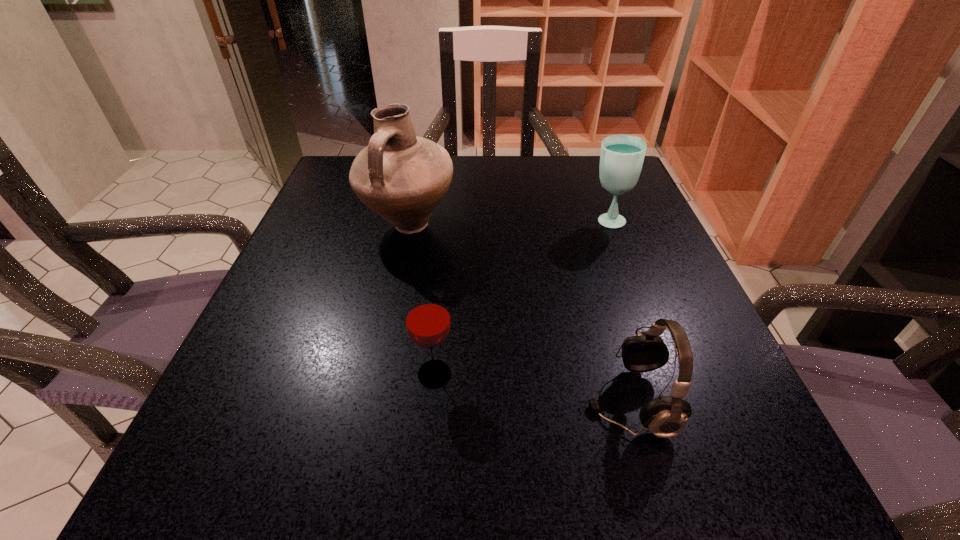
You are a GUI agent. You are given a task and a screenshot of the screen. Output one action in this format:
    pyautogui.click(x=<x>, y=<y>)
    Task: Click on the vacant area that lies between the left glass and the farther glass
    
    Given the screenshot: What is the action you would take?
    pyautogui.click(x=520, y=298)

At what (x,y) coordinates should I click in order to perform the action: click on vacant space that is in between the tallest object and the headset. Please return your answer as a coordinate pair (x, y). This screenshot has width=960, height=540. Looking at the image, I should click on (518, 313).

At what (x,y) coordinates should I click in order to perform the action: click on vacant area between the farther glass and the tallest object. Please return your answer as a coordinate pair (x, y). The height and width of the screenshot is (540, 960). Looking at the image, I should click on (508, 223).

Find the location of a particular element. The height and width of the screenshot is (540, 960). vacant space that's between the farther glass and the pitcher is located at coordinates (508, 223).

The image size is (960, 540). I want to click on object that ranks as the closest to the left glass, so click(666, 416).

Where is `object that is the closest to the right glass`? The image size is (960, 540). object that is the closest to the right glass is located at coordinates (402, 177).

This screenshot has width=960, height=540. I want to click on blank area in the image that satisfies the following two spatial constraints: 1. on the handle side of the pitcher; 2. on the right side of the shorter glass, so click(377, 374).